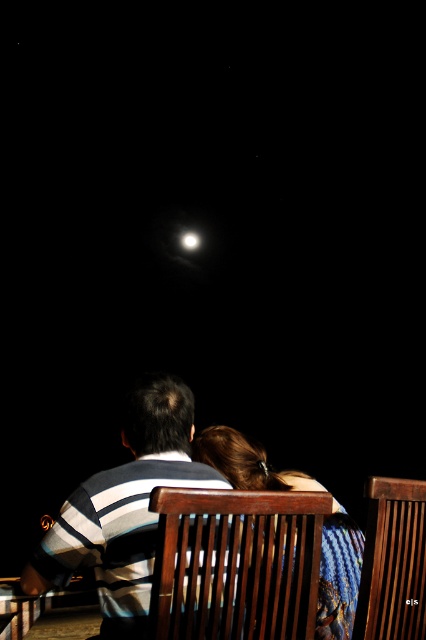
You are standing in front of the scene and want to touch the two points mentioned. Which point, point (80, 515) or point (207, 454), would require you to reach further out?

Point (207, 454) is further away from the camera than point (80, 515). Therefore, touching point (207, 454) would require reaching further out.